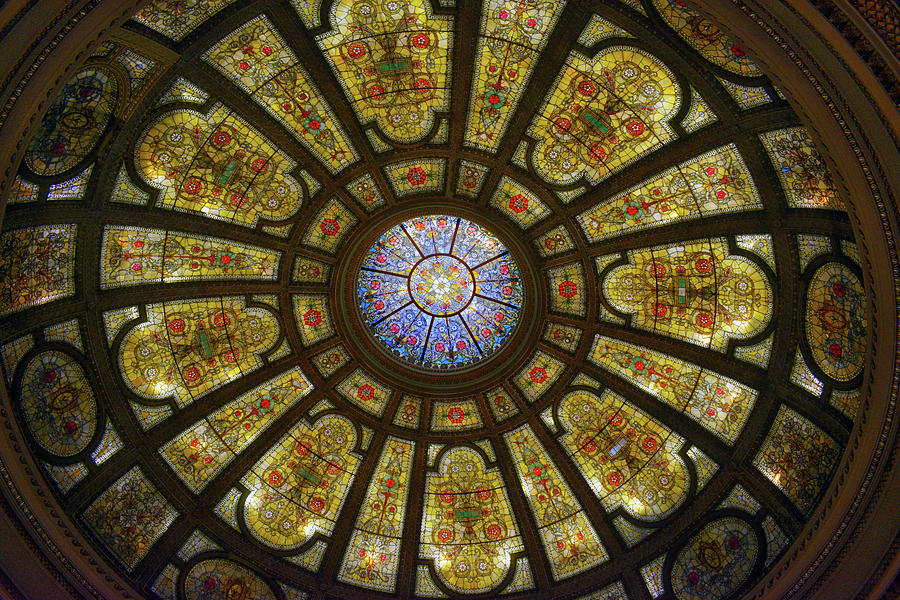
Where is `rim of ceiling`? The height and width of the screenshot is (600, 900). rim of ceiling is located at coordinates (860, 466).